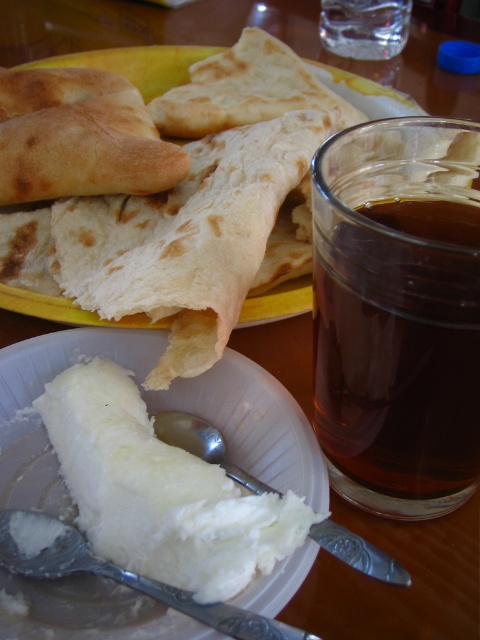
Can you confirm if white creamy mashed potato at center is shorter than silver metallic spoon at lower center?

No.

Does white creamy mashed potato at center appear on the left side of silver metallic spoon at lower center?

Yes, white creamy mashed potato at center is to the left of silver metallic spoon at lower center.

Who is more forward, (275, 496) or (392, 561)?

Positioned in front is point (392, 561).

The height and width of the screenshot is (640, 480). Identify the location of white creamy mashed potato at center. (159, 492).

Which is in front, point (314, 413) or point (274, 547)?

Positioned in front is point (274, 547).

Between brown liquid at right and white creamy mashed potato at center, which one is positioned higher?

brown liquid at right is above.

Which is behind, point (367, 358) or point (78, 372)?

The point (78, 372) is behind.

I want to click on brown liquid at right, so click(397, 376).

In the scene shown: Is white creamy mashed potato at center taller than silver metallic spoon at lower left?

Yes.

Can you confirm if white creamy mashed potato at center is shorter than silver metallic spoon at lower left?

In fact, white creamy mashed potato at center may be taller than silver metallic spoon at lower left.

Between point (245, 534) and point (43, 548), which one is positioned in front?

Point (245, 534) is more forward.

This screenshot has height=640, width=480. Find the location of `white creamy mashed potato at center`. white creamy mashed potato at center is located at coordinates (159, 492).